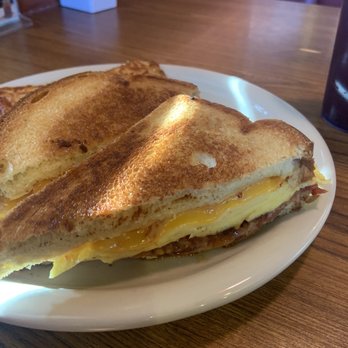
Identify the location of table. (274, 48).